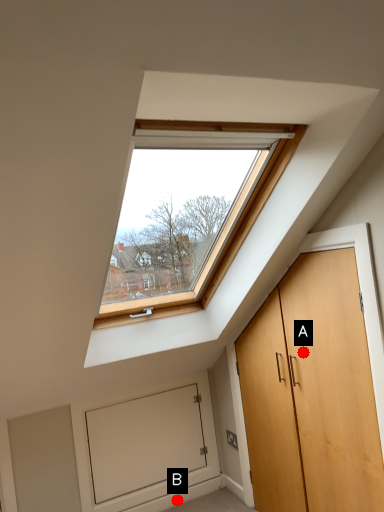
Question: Two points are circled on the image, labeled by A and B beside each circle. Which of the following is the closest to the observer?

Choices:
 (A) A is closer
 (B) B is closer

Answer: (A)